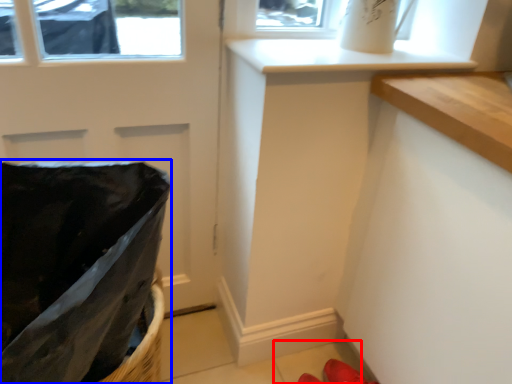
Question: Which point is closer to the camera, tile (highlighted by a red box) or laundry basket (highlighted by a blue box)?

Choices:
 (A) tile
 (B) laundry basket

Answer: (B)